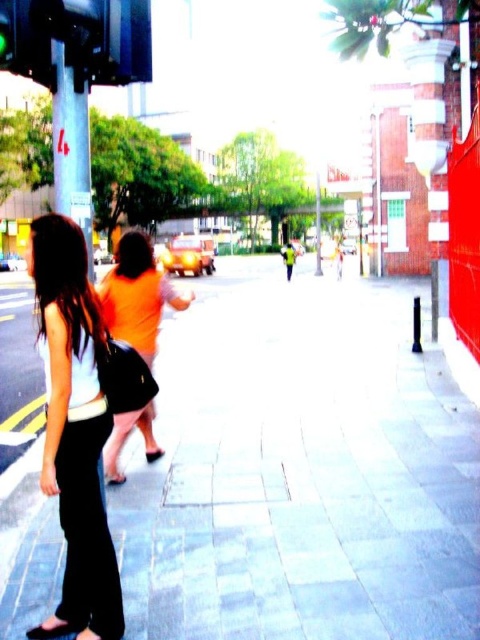
You are a delivery robot with a maximum reach distance of 3 meters. You need to drop a package onto the gray concrete pavement at center. Can you reach it from your current position?

The gray concrete pavement at center is 3.32 meters away from camera. Since the robot has a maximum reach distance of 3 meters, it cannot reach the gray concrete pavement at center.

You are a delivery person trying to navigate a busy street. You see the gray concrete pavement at center and the matte black pants at left. Which object is located to the right of the other?

The gray concrete pavement at center is positioned on the right side of matte black pants at left.

You are a delivery robot that needs to navigate through the street scene. The gray concrete pavement at center and the matte black pants at left are both in your path. Which path has a wider space for you to pass through?

The gray concrete pavement at center has a wider space than the matte black pants at left, so you should choose that path to pass through.